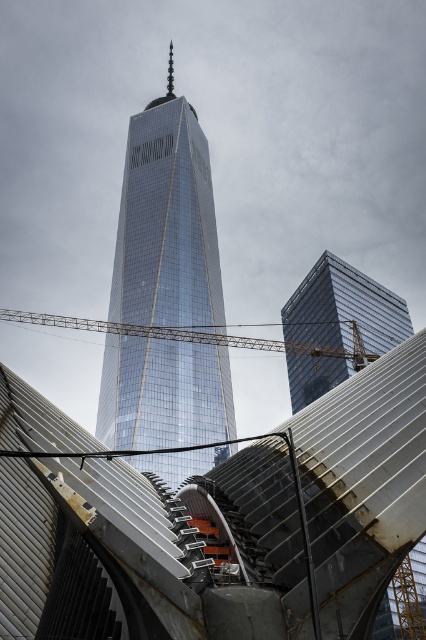
Question: Which object is the farthest from the glossy glass tower at center?

Choices:
 (A) metallic silver structure at center
 (B) metallic yellow crane at center

Answer: (A)

Question: Does metallic silver structure at center appear under metallic yellow crane at center?

Choices:
 (A) yes
 (B) no

Answer: (A)

Question: Which object is the farthest from the glossy glass tower at center?

Choices:
 (A) glossy glass building at center
 (B) metallic yellow crane at center
 (C) metallic silver structure at center

Answer: (C)

Question: Can you confirm if glossy glass tower at center is positioned to the right of glossy glass building at center?

Choices:
 (A) yes
 (B) no

Answer: (B)

Question: From the image, what is the correct spatial relationship of metallic silver structure at center in relation to glossy glass building at center?

Choices:
 (A) left
 (B) right

Answer: (A)

Question: Estimate the real-world distances between objects in this image. Which object is closer to the glossy glass building at center?

Choices:
 (A) metallic yellow crane at center
 (B) metallic silver structure at center

Answer: (A)